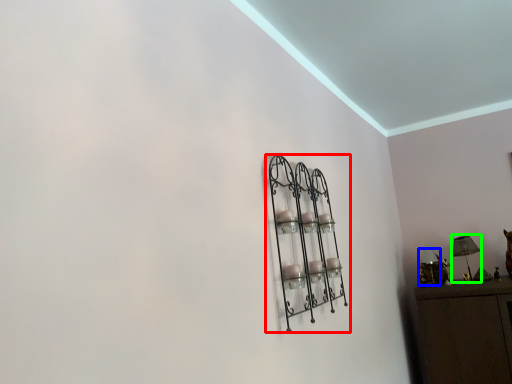
Question: Considering the real-world distances, which object is farthest from shelf (highlighted by a red box)? lamp (highlighted by a blue box) or table lamp (highlighted by a green box)?

Choices:
 (A) lamp
 (B) table lamp

Answer: (B)